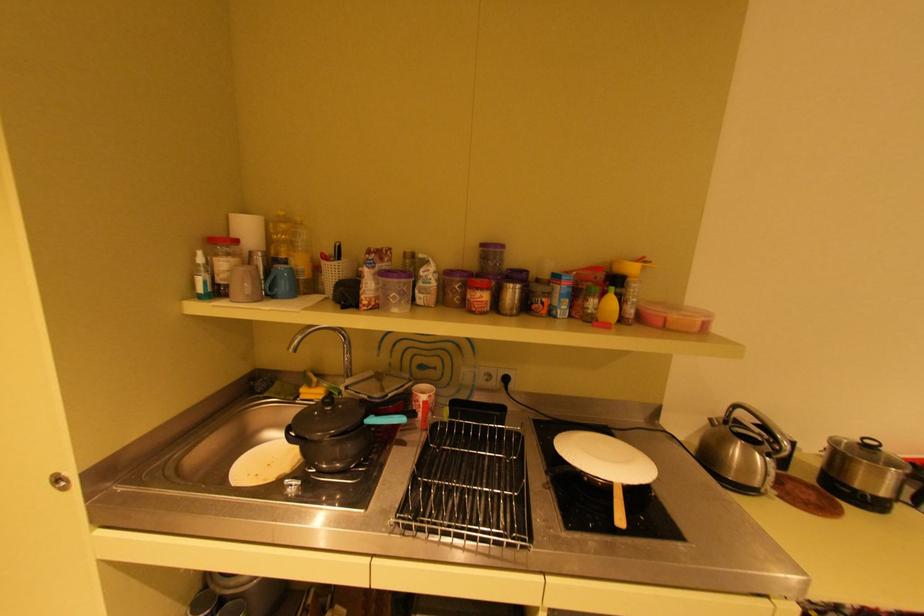
Find where to lift the black pot lid handle. Please return your answer as a coordinate pair (x, y).

(329, 399)